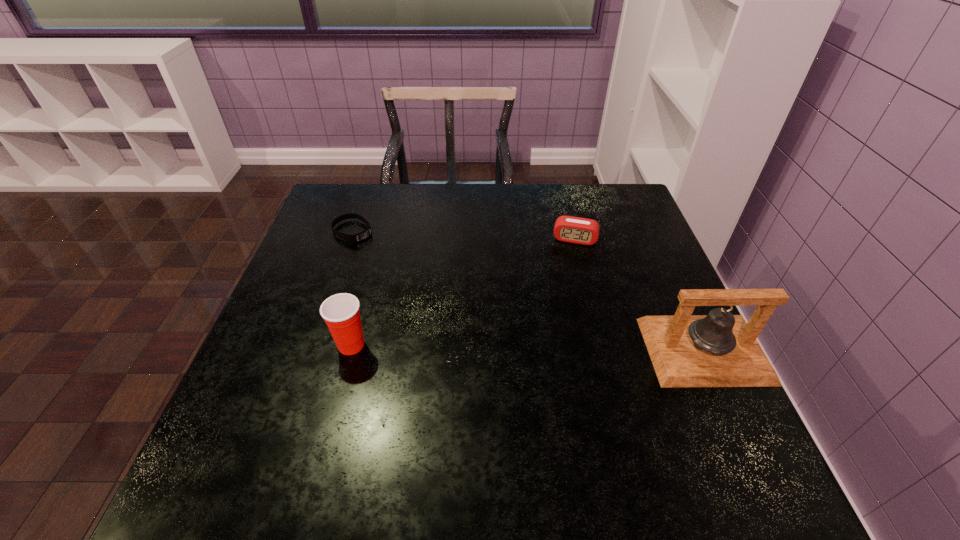
This screenshot has height=540, width=960. I want to click on free space on the desktop that is between the Dixie cup and the rightmost object and is positioned on the front-facing side of the third object from left to right, so click(557, 348).

Image resolution: width=960 pixels, height=540 pixels. Find the location of `vacant space on the desktop that is between the Dixie cup and the bell and is positioned on the display of the wristband`. vacant space on the desktop that is between the Dixie cup and the bell and is positioned on the display of the wristband is located at coordinates (529, 348).